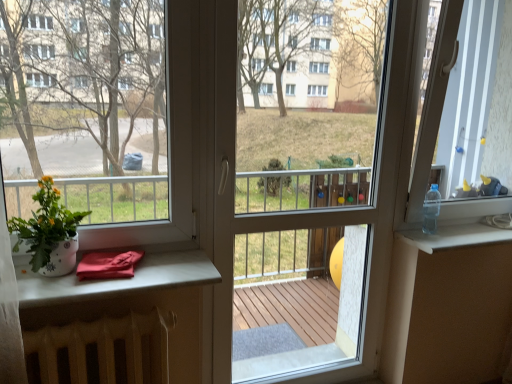
This screenshot has height=384, width=512. Identify the location of free space in front of clear plastic bottle at upper right. (437, 239).